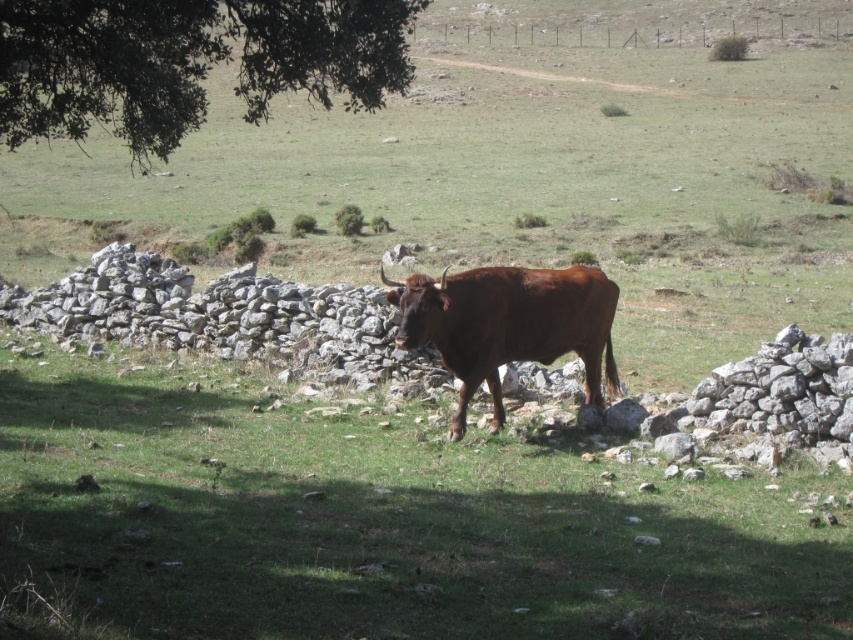
Between green leafy tree at upper left and brown glossy bull at center, which one is positioned higher?

green leafy tree at upper left is above.

Is point (352, 88) positioned after point (556, 317)?

No, (352, 88) is in front of (556, 317).

Does point (289, 20) come farther from viewer compared to point (508, 269)?

No.

Locate an element on the screen. green leafy tree at upper left is located at coordinates (189, 61).

Between brown grassy at center and green leafy tree at upper left, which one has more height?

With more height is green leafy tree at upper left.

Is point (381, 570) in front of point (59, 17)?

Yes, it is in front of point (59, 17).

This screenshot has height=640, width=853. I want to click on brown grassy at center, so click(376, 524).

Is brown grassy at center above brown glossy bull at center?

No.

Does brown grassy at center lie behind brown glossy bull at center?

No, it is not.

Who is more distant from viewer, (x=691, y=534) or (x=602, y=278)?

The point (x=602, y=278) is behind.

Find the location of a particular element. This screenshot has height=640, width=853. brown grassy at center is located at coordinates (376, 524).